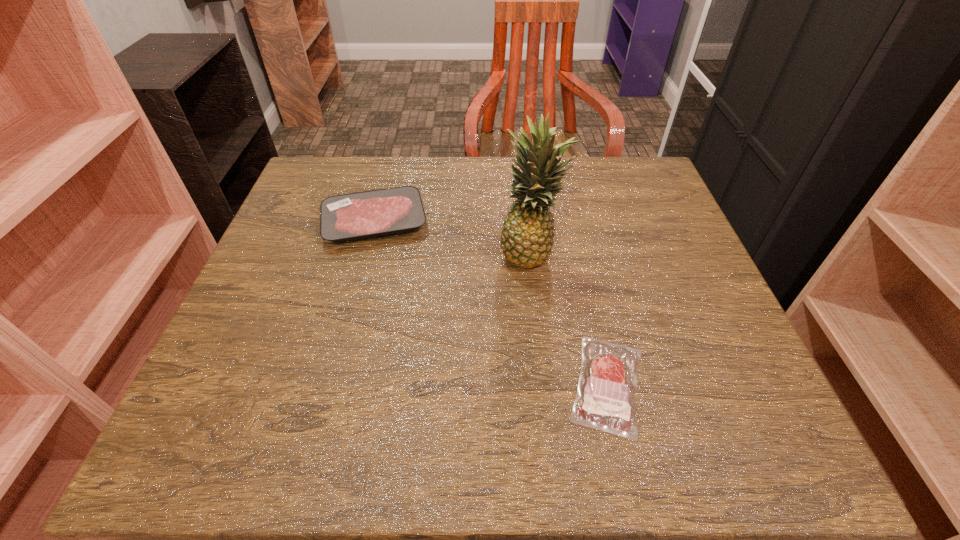
This screenshot has width=960, height=540. What are the coordinates of `the closest object to the tallest object` in the screenshot? It's located at (607, 385).

Image resolution: width=960 pixels, height=540 pixels. I want to click on free location that satisfies the following two spatial constraints: 1. on the front side of the pineapple; 2. on the right side of the nearest object, so click(547, 384).

Where is `free location that satisfies the following two spatial constraints: 1. on the front side of the nearest object; 2. on the left side of the farther steak`? The height and width of the screenshot is (540, 960). free location that satisfies the following two spatial constraints: 1. on the front side of the nearest object; 2. on the left side of the farther steak is located at coordinates (332, 384).

Locate an element on the screen. free location that satisfies the following two spatial constraints: 1. on the front side of the pineapple; 2. on the left side of the left steak is located at coordinates (366, 254).